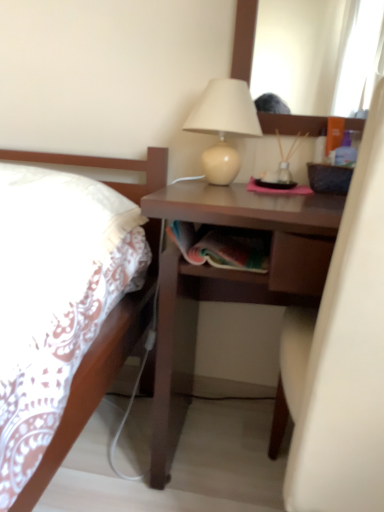
Question: Is matte beige lamp at upper center behind brown matte desk at center?

Choices:
 (A) yes
 (B) no

Answer: (A)

Question: From the image's perspective, is matte beige lamp at upper center on top of brown matte desk at center?

Choices:
 (A) yes
 (B) no

Answer: (A)

Question: Is matte beige lamp at upper center to the right of brown matte desk at center from the viewer's perspective?

Choices:
 (A) no
 (B) yes

Answer: (A)

Question: Is matte beige lamp at upper center bigger than brown matte desk at center?

Choices:
 (A) no
 (B) yes

Answer: (A)

Question: Is matte beige lamp at upper center completely or partially outside of brown matte desk at center?

Choices:
 (A) no
 (B) yes

Answer: (B)

Question: Is matte beige lamp at upper center at the left side of brown matte desk at center?

Choices:
 (A) no
 (B) yes

Answer: (B)

Question: Can you confirm if brown matte desk at center is smaller than matte beige lamp at upper center?

Choices:
 (A) no
 (B) yes

Answer: (A)

Question: From the image's perspective, does brown matte desk at center appear higher than matte beige lamp at upper center?

Choices:
 (A) yes
 (B) no

Answer: (B)

Question: Is brown matte desk at center positioned behind matte beige lamp at upper center?

Choices:
 (A) yes
 (B) no

Answer: (B)

Question: Is brown matte desk at center with matte beige lamp at upper center?

Choices:
 (A) yes
 (B) no

Answer: (B)

Question: Does brown matte desk at center have a greater height compared to matte beige lamp at upper center?

Choices:
 (A) no
 (B) yes

Answer: (B)

Question: From a real-world perspective, is brown matte desk at center positioned over matte beige lamp at upper center based on gravity?

Choices:
 (A) yes
 (B) no

Answer: (B)

Question: Is point (157, 407) positioned closer to the camera than point (210, 119)?

Choices:
 (A) closer
 (B) farther

Answer: (A)